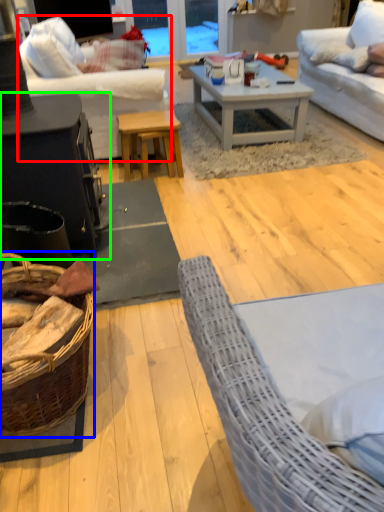
Question: Which object is the farthest from studio couch (highlighted by a red box)? Choose among these: basket (highlighted by a blue box) or table (highlighted by a green box).

Choices:
 (A) basket
 (B) table

Answer: (A)